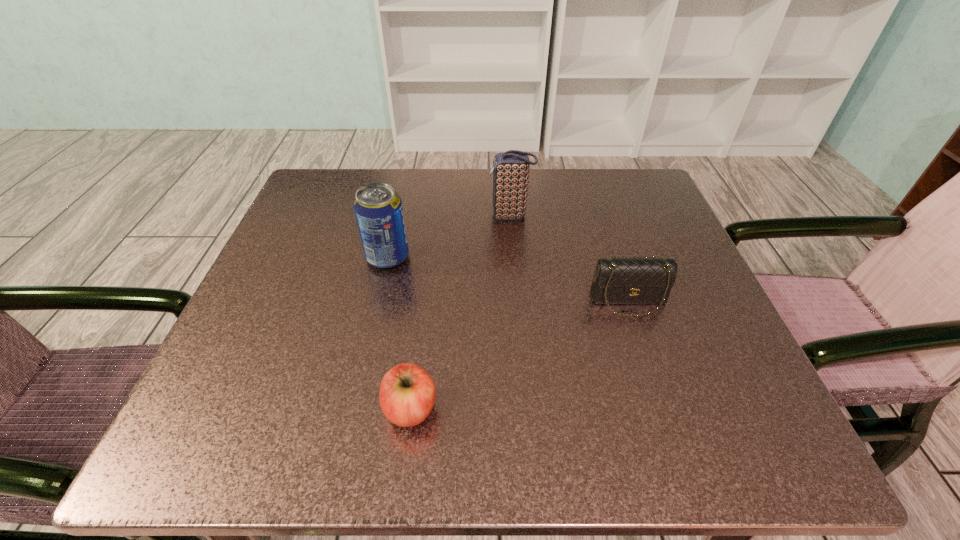
Locate an element on the screen. Image resolution: width=960 pixels, height=540 pixels. the second object from right to left is located at coordinates (510, 169).

The height and width of the screenshot is (540, 960). I want to click on the farther clutch bag, so click(x=510, y=169).

I want to click on the third nearest object, so click(x=378, y=209).

The height and width of the screenshot is (540, 960). What are the coordinates of `soda` in the screenshot? It's located at (378, 209).

At what (x,y) coordinates should I click in order to perform the action: click on the right clutch bag. Please return your answer as a coordinate pair (x, y). Looking at the image, I should click on point(621,280).

What are the coordinates of `the shorter clutch bag` in the screenshot? It's located at (621, 280).

I want to click on the nearest object, so click(x=407, y=393).

Identify the location of the third object from right to left. (407, 393).

The width and height of the screenshot is (960, 540). What are the coordinates of `vacant position located 0.300m with the zip open on the left clutch bag` in the screenshot? It's located at (350, 216).

You are a GUI agent. You are given a task and a screenshot of the screen. Output one action in this format:
    pyautogui.click(x=<x>, y=<y>)
    Task: Click on the vacant space located with the zip open on the left clutch bag
    
    Given the screenshot: What is the action you would take?
    pyautogui.click(x=401, y=216)